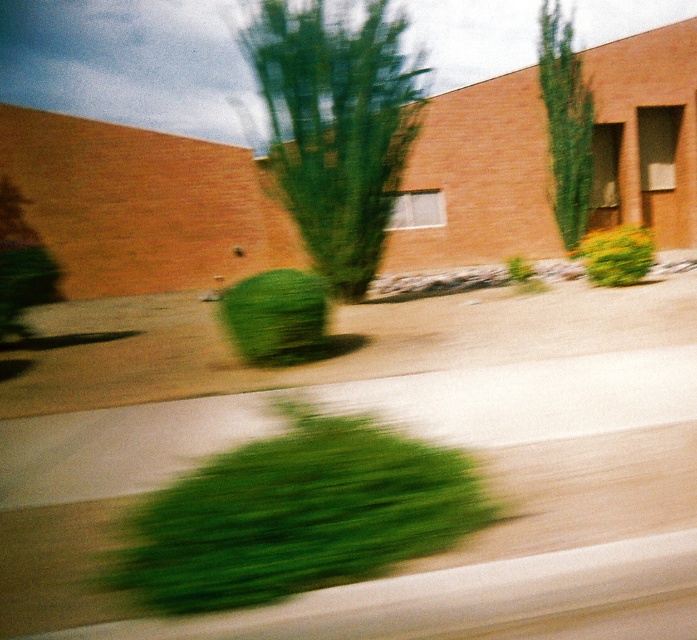
Question: Which object appears closest to the camera in this image?

Choices:
 (A) green leafy tree at upper center
 (B) green leafy tree at center
 (C) green fuzzy bush at center
 (D) yellow-green textured bush at center-right

Answer: (C)

Question: Which of the following is the closest to the observer?

Choices:
 (A) yellow-green textured bush at center-right
 (B) green leafy hedge at lower center
 (C) green fuzzy bush at center
 (D) green leafy tree at center

Answer: (B)

Question: Is green leafy tree at center positioned behind green leafy tree at upper center?

Choices:
 (A) no
 (B) yes

Answer: (A)

Question: Among these points, which one is nearest to the camera?

Choices:
 (A) (608, 230)
 (B) (353, 51)

Answer: (B)

Question: Is green leafy tree at upper center positioned in front of green fuzzy bush at center?

Choices:
 (A) no
 (B) yes

Answer: (A)

Question: From the image, what is the correct spatial relationship of green leafy tree at center in relation to green leafy tree at upper center?

Choices:
 (A) below
 (B) above

Answer: (B)